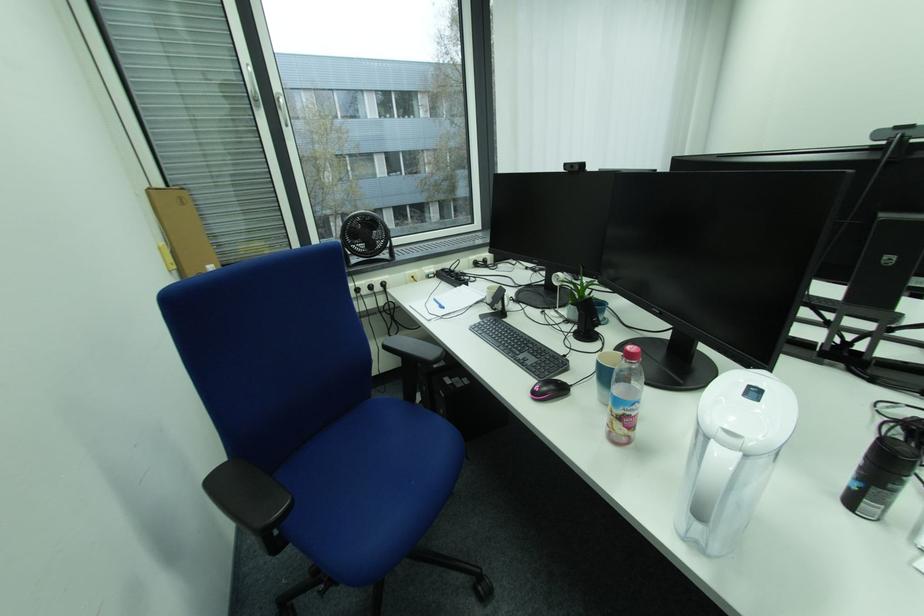
Which object does [880,477] point to?

This point indicates the black spray can.